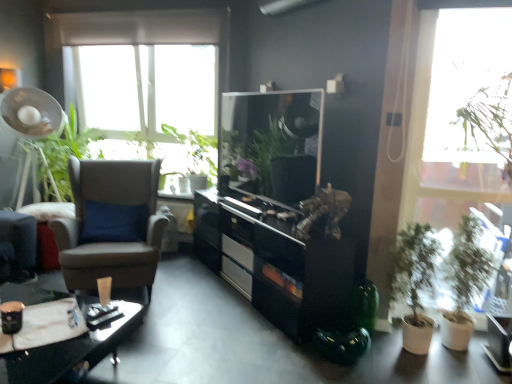
Question: Which direction should I rotate to face green leafy plant at upper center, arranged as the second vegetation when viewed from the left, — up or down?

Choices:
 (A) down
 (B) up

Answer: (B)

Question: Is the position of green matte plant at right, the 1th houseplant when ordered from left to right, less distant than that of matte black desk at lower left?

Choices:
 (A) yes
 (B) no

Answer: (B)

Question: From the image's perspective, is green matte plant at right, the 1th houseplant when ordered from left to right, on top of matte black desk at lower left?

Choices:
 (A) no
 (B) yes

Answer: (B)

Question: From a real-world perspective, is green matte plant at right, the 1th houseplant when ordered from left to right, physically below matte black desk at lower left?

Choices:
 (A) no
 (B) yes

Answer: (A)

Question: From a real-world perspective, is green matte plant at right, placed as the 2th houseplant when sorted from right to left, physically above matte black desk at lower left?

Choices:
 (A) no
 (B) yes

Answer: (B)

Question: Considering the relative positions of green matte plant at right, the 1th houseplant when ordered from left to right, and matte black desk at lower left in the image provided, is green matte plant at right, the 1th houseplant when ordered from left to right, behind matte black desk at lower left?

Choices:
 (A) no
 (B) yes

Answer: (B)

Question: Does green matte plant at right, placed as the 2th houseplant when sorted from right to left, have a larger size compared to matte black desk at lower left?

Choices:
 (A) no
 (B) yes

Answer: (A)

Question: Is green leafy plant at left, which ranks as the second vegetation in right-to-left order, not within transparent glass window at upper right?

Choices:
 (A) no
 (B) yes

Answer: (B)

Question: Does green leafy plant at left, the 1th vegetation from the left, have a lesser height compared to transparent glass window at upper right?

Choices:
 (A) no
 (B) yes

Answer: (B)

Question: Is green leafy plant at left, which ranks as the second vegetation in right-to-left order, in front of transparent glass window at upper right?

Choices:
 (A) yes
 (B) no

Answer: (B)

Question: Is green leafy plant at left, which ranks as the second vegetation in right-to-left order, next to transparent glass window at upper right?

Choices:
 (A) no
 (B) yes

Answer: (A)

Question: From the image's perspective, is green leafy plant at left, the 1th vegetation from the left, below transparent glass window at upper right?

Choices:
 (A) no
 (B) yes

Answer: (A)

Question: Could you tell me if green leafy plant at left, the 1th vegetation from the left, is facing transparent glass window at upper right?

Choices:
 (A) yes
 (B) no

Answer: (B)

Question: Does green leafy plant at upper center, which is the 1th vegetation from right to left, have a smaller size compared to brown leather chair at left?

Choices:
 (A) yes
 (B) no

Answer: (A)